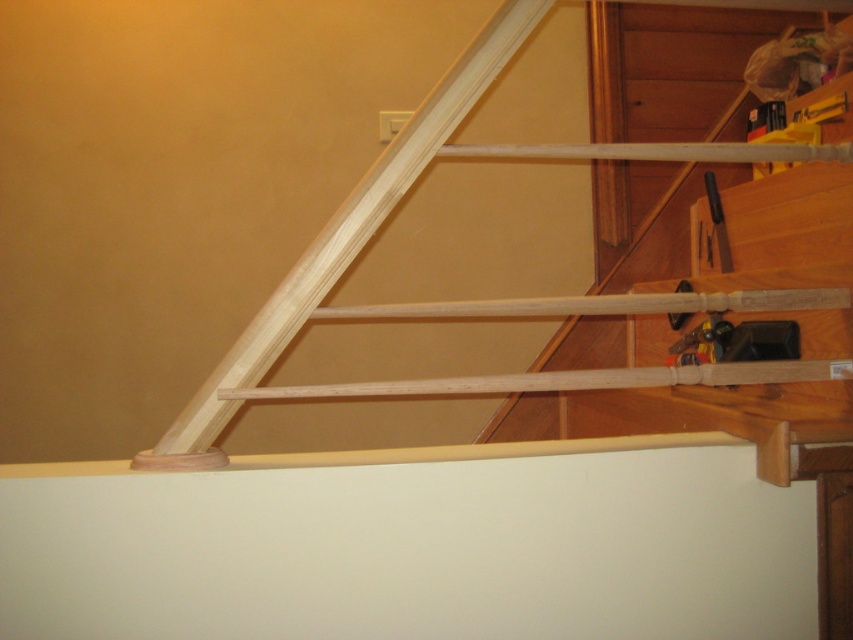
Does natural wood handrail at upper right lie in front of black plastic screwdriver at upper right?

No, it is not.

Does point (712, 17) come farther from viewer compared to point (714, 211)?

Yes, it is behind point (714, 211).

Find the location of a particular element. This screenshot has width=853, height=640. natural wood handrail at upper right is located at coordinates (672, 68).

Which is in front, point (660, 1) or point (683, 310)?

Point (660, 1) is in front.

Find the location of a particular element. This screenshot has width=853, height=640. natural wood ladder at upper center is located at coordinates (341, 241).

The height and width of the screenshot is (640, 853). I want to click on natural wood ladder at upper center, so click(x=341, y=241).

Does natural wood handrail at upper right have a greater width compared to natural wood ladder at upper center?

In fact, natural wood handrail at upper right might be narrower than natural wood ladder at upper center.

Does natural wood handrail at upper right appear on the right side of natural wood ladder at upper center?

Yes, natural wood handrail at upper right is to the right of natural wood ladder at upper center.

Between point (672, 241) and point (450, 81), which one is positioned in front?

Point (450, 81) is in front.

You are a GUI agent. You are given a task and a screenshot of the screen. Output one action in this format:
    pyautogui.click(x=<x>, y=<y>)
    Task: Click on the natural wood handrail at upper right
    The image size is (853, 640).
    Given the screenshot: What is the action you would take?
    pyautogui.click(x=672, y=68)